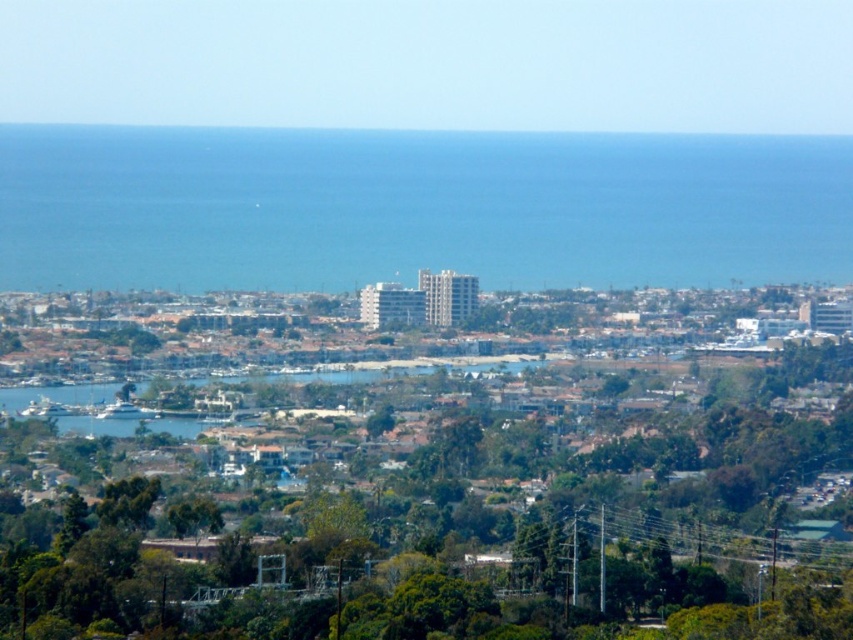
Question: Which object appears farthest from the camera in this image?

Choices:
 (A) green leafy tree at center
 (B) blue water at center

Answer: (A)

Question: Is green leafy tree at center above blue water at center?

Choices:
 (A) yes
 (B) no

Answer: (B)

Question: Which point appears farthest from the camera in this image?

Choices:
 (A) (378, 458)
 (B) (125, 266)

Answer: (B)

Question: Can you confirm if green leafy tree at center is positioned to the left of blue water at center?

Choices:
 (A) yes
 (B) no

Answer: (A)

Question: Does green leafy tree at center appear under blue water at center?

Choices:
 (A) yes
 (B) no

Answer: (A)